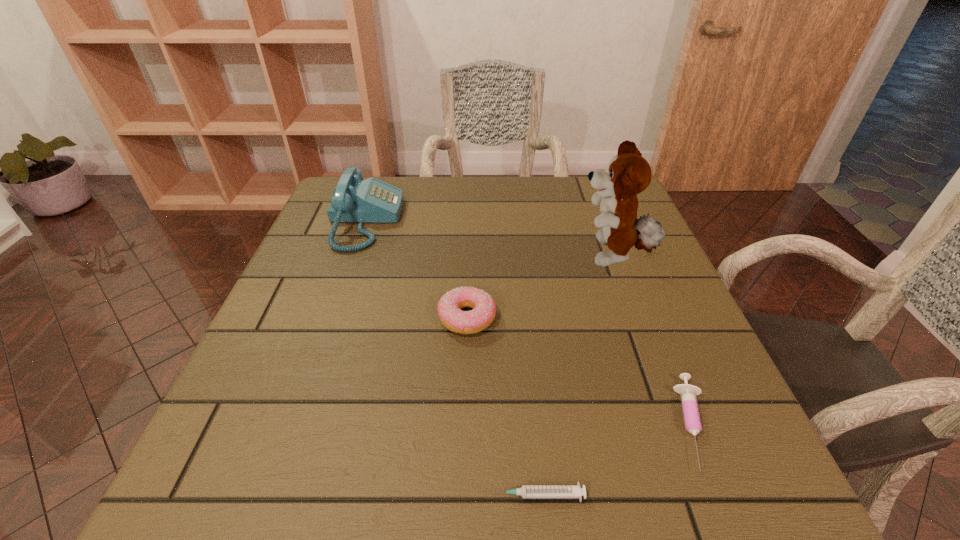
You are a GUI agent. You are given a task and a screenshot of the screen. Output one action in this format:
    pyautogui.click(x=<x>, y=<y>)
    Task: Click on the puppy situated at the right edge
    The width and height of the screenshot is (960, 540).
    Given the screenshot: What is the action you would take?
    pyautogui.click(x=628, y=173)

You are a GUI agent. You are given a task and a screenshot of the screen. Output one action in this format:
    pyautogui.click(x=<x>, y=<y>)
    Task: Click on the syringe situated at the right edge
    The image size is (960, 540).
    Given the screenshot: What is the action you would take?
    pyautogui.click(x=692, y=421)

I want to click on object positioned at the far left corner, so click(x=354, y=200).

You are a GUI agent. You are given a task and a screenshot of the screen. Output one action in this format:
    pyautogui.click(x=<x>, y=<y>)
    Task: Click on the object positioned at the near right corner
    
    Given the screenshot: What is the action you would take?
    pyautogui.click(x=692, y=421)

Identify the location of free space at the far edge of the desktop. (456, 197).

The height and width of the screenshot is (540, 960). Find the location of `blank area at the near edge`. blank area at the near edge is located at coordinates (524, 466).

In order to click on vacant area at the left edge in this screenshot , I will do `click(273, 381)`.

Where is `free space at the right edge`? This screenshot has height=540, width=960. free space at the right edge is located at coordinates (702, 436).

The height and width of the screenshot is (540, 960). I want to click on free space between the shortest object and the telephone, so click(451, 358).

Locate an element on the screen. This screenshot has height=540, width=960. vacant point located between the second tallest object and the doughnut is located at coordinates (416, 269).